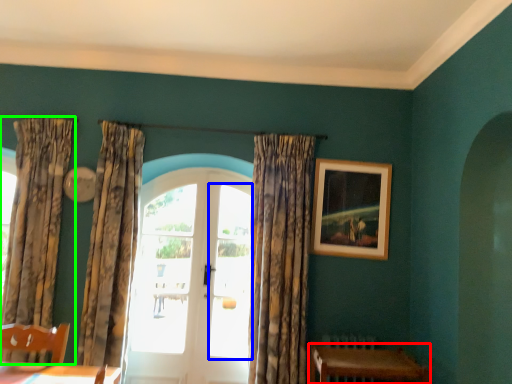
Question: Estimate the real-world distances between objects in this image. Which object is closer to table (highlighted by a red box), window (highlighted by a blue box) or curtain (highlighted by a green box)?

Choices:
 (A) window
 (B) curtain

Answer: (A)